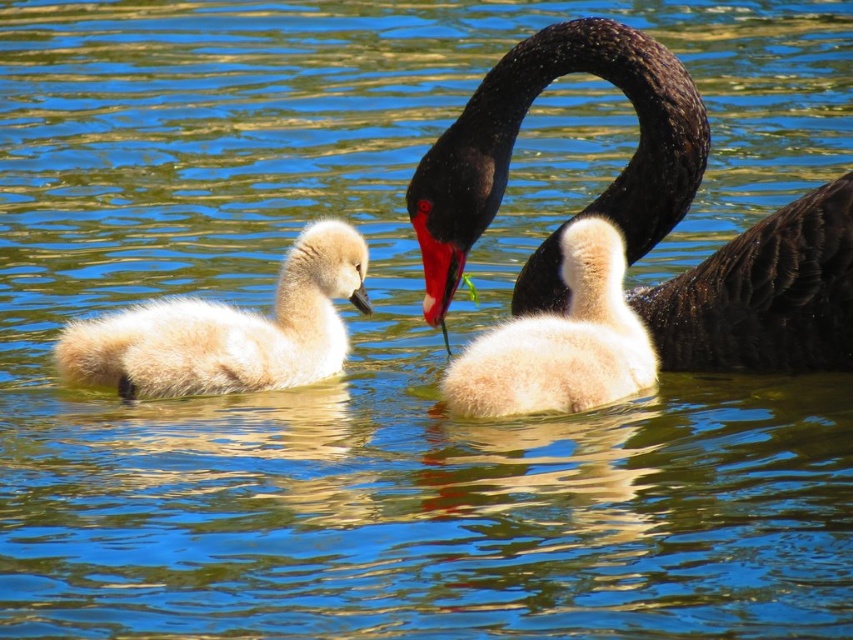
You are a photographer trying to capture a photo of the white fluffy swan at left and the fluffy white cygnet at center. Which one is positioned lower in the image?

The white fluffy swan at left is positioned below the fluffy white cygnet at center, so it is lower in the image.

In the scene shown: You are a photographer trying to capture the black swan at the center of the image. The camera you are using has a focus point at coordinate point (517, 132). Will the black swan at center be in focus?

Yes, the shiny black swan at center is located at point (517, 132), so the focus point will be directly on it, ensuring it is in focus.

You are a birdwatcher observing the scene. You notice the shiny black swan at center and the white fluffy swan at left. Which one is larger in size?

The shiny black swan at center is bigger than the white fluffy swan at left.